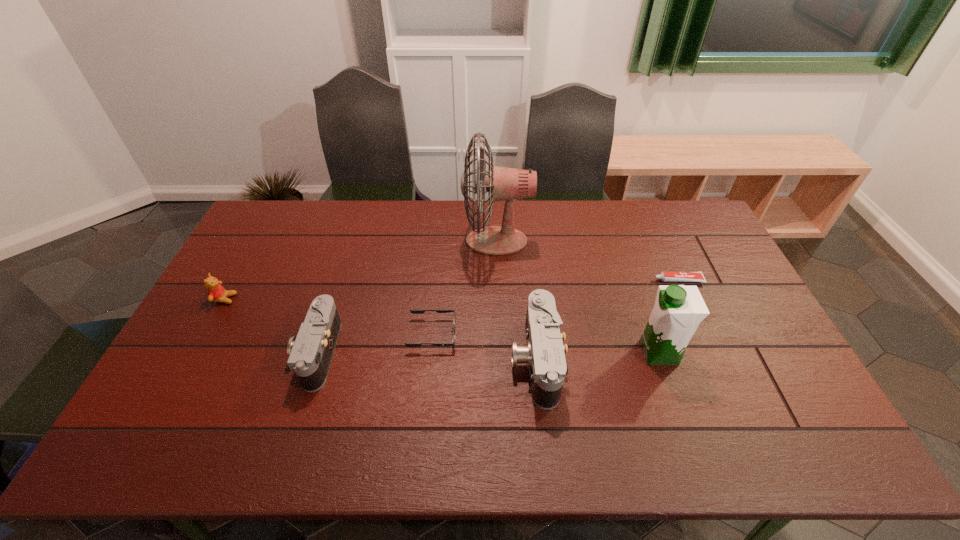
Locate an element on the screen. The width and height of the screenshot is (960, 540). the sixth object from right to left is located at coordinates (310, 354).

Locate an element on the screen. This screenshot has height=540, width=960. the left camera is located at coordinates (310, 354).

The width and height of the screenshot is (960, 540). Find the location of `the fifth shortest object`. the fifth shortest object is located at coordinates (544, 353).

This screenshot has height=540, width=960. I want to click on the right camera, so click(544, 353).

I want to click on the tallest object, so click(502, 183).

This screenshot has width=960, height=540. What are the coordinates of `the farthest object` in the screenshot? It's located at (502, 183).

Identify the location of the third shortest object. (216, 293).

You are a GUI agent. You are given a task and a screenshot of the screen. Output one action in this format:
    pyautogui.click(x=<x>, y=<y>)
    Task: Click on the teddy bear
    This screenshot has height=540, width=960.
    Given the screenshot: What is the action you would take?
    pyautogui.click(x=216, y=293)

Locate an element on the screen. The image size is (960, 540). the third object from left to right is located at coordinates (414, 311).

What are the coordinates of `the sixth tallest object` in the screenshot? It's located at (414, 311).